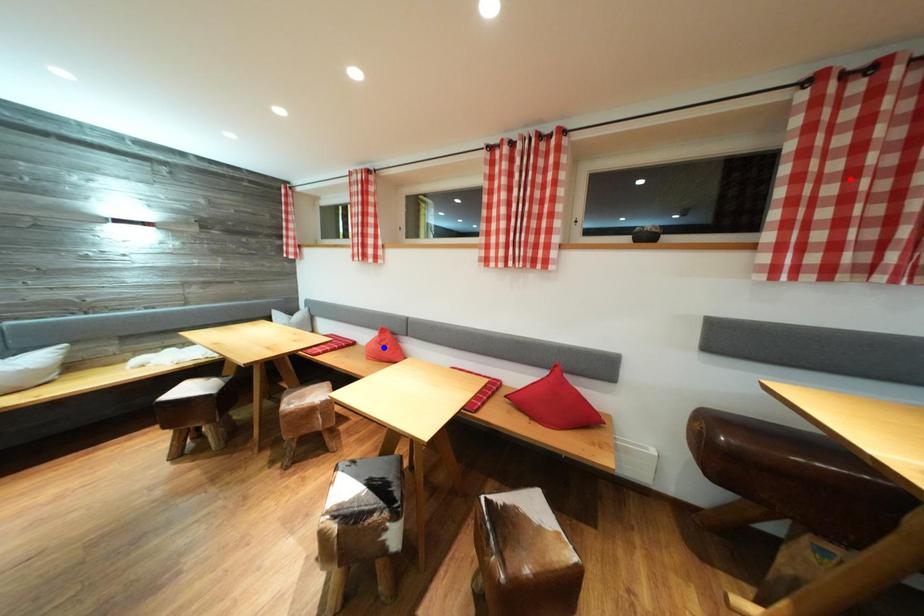
Question: In the image, two points are highlighted. Which point is nearer to the camera? Reply with the corresponding letter.

Choices:
 (A) blue point
 (B) red point

Answer: (B)